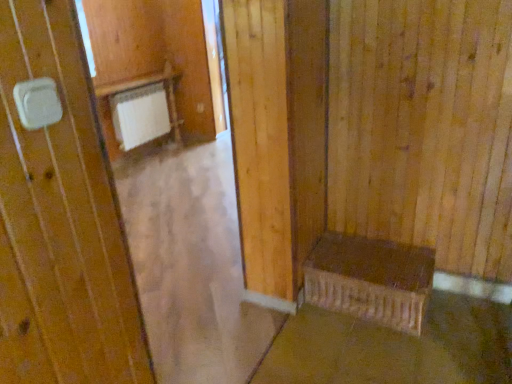
Question: In terms of height, does brown concrete at lower right look taller or shorter compared to brown wooden bench at lower right?

Choices:
 (A) tall
 (B) short

Answer: (B)

Question: Considering the positions of point (431, 299) and point (324, 276), is point (431, 299) closer or farther from the camera than point (324, 276)?

Choices:
 (A) farther
 (B) closer

Answer: (A)

Question: Considering the positions of brown concrete at lower right and brown wooden bench at lower right in the image, is brown concrete at lower right bigger or smaller than brown wooden bench at lower right?

Choices:
 (A) big
 (B) small

Answer: (B)

Question: From the image's perspective, is brown wooden bench at lower right positioned above or below brown concrete at lower right?

Choices:
 (A) above
 (B) below

Answer: (A)

Question: Is point (358, 271) closer or farther from the camera than point (435, 347)?

Choices:
 (A) farther
 (B) closer

Answer: (A)

Question: In terms of size, does brown wooden bench at lower right appear bigger or smaller than brown concrete at lower right?

Choices:
 (A) small
 (B) big

Answer: (B)

Question: In the image, is brown wooden bench at lower right positioned in front of or behind brown concrete at lower right?

Choices:
 (A) behind
 (B) front

Answer: (A)